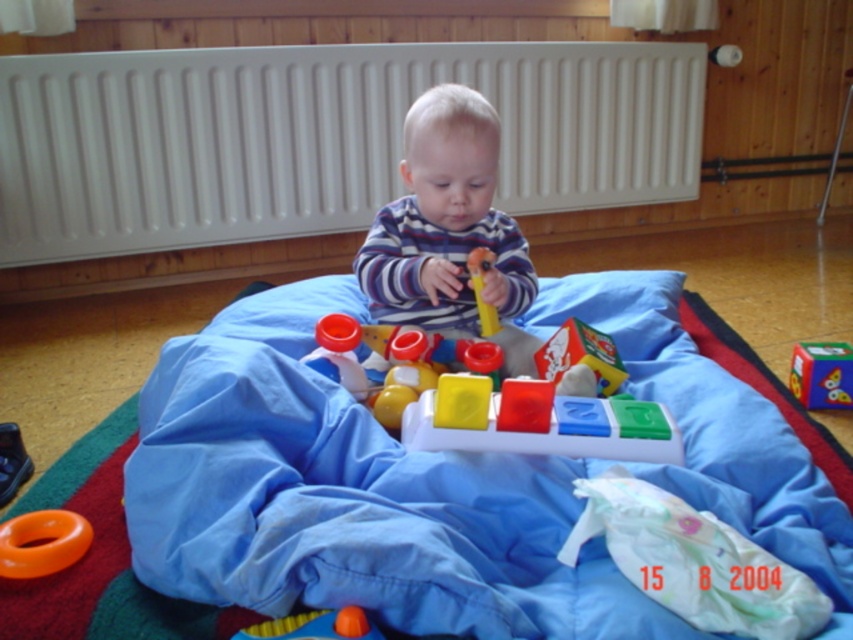
You are a parent trying to organize the play area. You want to place the orange rubber ring at lower left closer to the child. However, there is a blue fabric blanket at center in the way. Can you move the blanket to access the ring?

The blue fabric blanket at center is above the orange rubber ring at lower left, so you need to move the blanket first to reach the ring.

You are a parent trying to organize the toys. You see the multicolored plastic cube at center and the rubber orange ball at lower left. Which toy is positioned higher up in the image?

The multicolored plastic cube at center is positioned higher up than the rubber orange ball at lower left because it is above it according to the description.